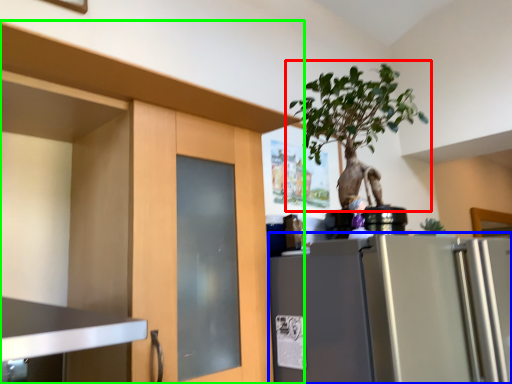
Question: Which object is positioned farthest from houseplant (highlighted by a red box)? Select from refrigerator (highlighted by a blue box) and cabinetry (highlighted by a green box).

Choices:
 (A) refrigerator
 (B) cabinetry

Answer: (A)